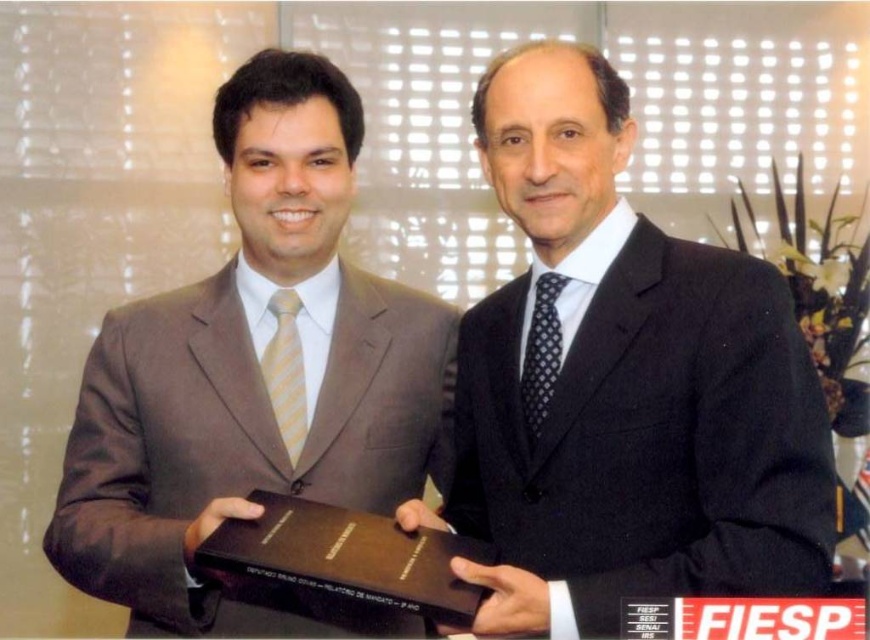
Looking at this image, you are a photographer setting up a photo shoot for two men holding certificates. The men are wearing the black matte suit at center and brown suit at left. You need to ensure that the narrower suit is positioned to the right side of the frame to balance the composition. Which suit should you place on the right?

The black matte suit at center has a lesser width compared to the brown suit at left, so you should place the black matte suit at center on the right side of the frame to balance the composition.

You are a photographer setting up for an event. You need to position a light source to the right of the brown suit at left to highlight it. Is the light source placement feasible given their current positions?

The brown suit at left is located at point (255,384), so placing the light source to the right of it should be feasible as long as there is space in that direction.

You are a photographer setting up for a formal event. You need to position two suits for a photo shoot. The black matte suit at center and the brown suit at left must be arranged based on their positions in the original image. Which suit should be placed higher to replicate the original setup?

Result: The black matte suit at center should be placed higher than the brown suit at left to replicate the original setup as described.